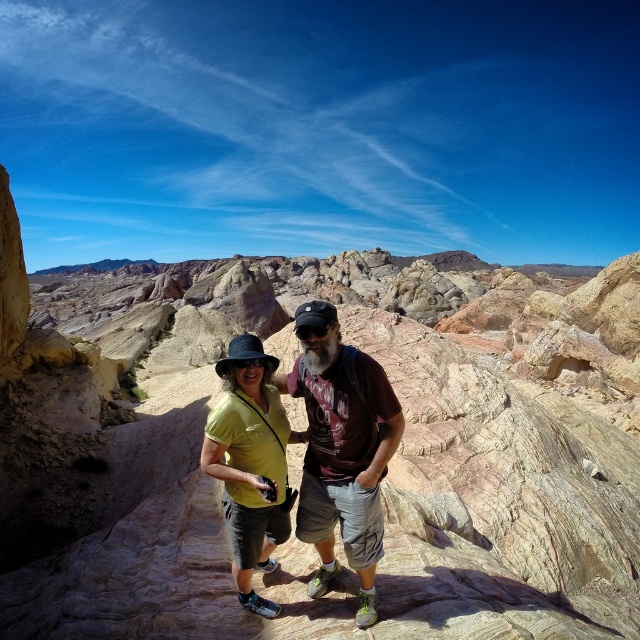
Which of these two, rustic stone canyon at center or matte brown t-shirt at center, stands shorter?

matte brown t-shirt at center

Is rustic stone canyon at center in front of matte brown t-shirt at center?

That is True.

What do you see at coordinates (384, 481) in the screenshot?
I see `rustic stone canyon at center` at bounding box center [384, 481].

You are a GUI agent. You are given a task and a screenshot of the screen. Output one action in this format:
    pyautogui.click(x=<x>, y=<y>)
    Task: Click on the rustic stone canyon at center
    This screenshot has width=640, height=640.
    Given the screenshot: What is the action you would take?
    pyautogui.click(x=384, y=481)

Is rustic stone canyon at center wider than matte yellow shirt at center?

Yes.

Does point (113, 445) lie behind point (260, 493)?

Yes.

Find the location of `rustic stone canyon at center`. rustic stone canyon at center is located at coordinates (384, 481).

This screenshot has height=640, width=640. Identify the location of rustic stone canyon at center. (384, 481).

Which is in front, point (364, 520) or point (227, 428)?

Point (364, 520) is in front.

Which is behind, point (374, 502) or point (246, 520)?

The point (246, 520) is behind.

Is point (326, 480) closer to camera compared to point (237, 468)?

No, (326, 480) is behind (237, 468).

Locate an element on the screen. The width and height of the screenshot is (640, 640). matte brown t-shirt at center is located at coordinates (340, 449).